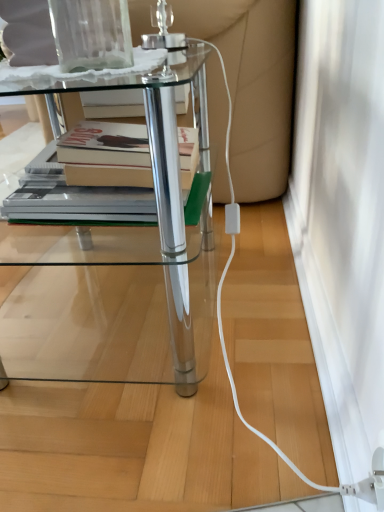
Question: Is clear glass table at center not near transparent glass vase at upper center?

Choices:
 (A) yes
 (B) no

Answer: (B)

Question: Can you confirm if clear glass table at center is taller than transparent glass vase at upper center?

Choices:
 (A) no
 (B) yes

Answer: (B)

Question: Does clear glass table at center turn towards transparent glass vase at upper center?

Choices:
 (A) yes
 (B) no

Answer: (B)

Question: From the image's perspective, is clear glass table at center located beneath transparent glass vase at upper center?

Choices:
 (A) yes
 (B) no

Answer: (A)

Question: Considering the relative positions of clear glass table at center and transparent glass vase at upper center in the image provided, is clear glass table at center to the right of transparent glass vase at upper center from the viewer's perspective?

Choices:
 (A) no
 (B) yes

Answer: (B)

Question: Is clear glass table at center bigger than transparent glass vase at upper center?

Choices:
 (A) no
 (B) yes

Answer: (B)

Question: From the image's perspective, is white matte screen door at lower right on clear glass table at center?

Choices:
 (A) yes
 (B) no

Answer: (B)

Question: Would you say clear glass table at center is part of white matte screen door at lower right's contents?

Choices:
 (A) yes
 (B) no

Answer: (B)

Question: Considering the relative positions of white matte screen door at lower right and clear glass table at center in the image provided, is white matte screen door at lower right to the right of clear glass table at center from the viewer's perspective?

Choices:
 (A) yes
 (B) no

Answer: (A)

Question: Is white matte screen door at lower right oriented towards clear glass table at center?

Choices:
 (A) no
 (B) yes

Answer: (B)

Question: Considering the relative sizes of white matte screen door at lower right and clear glass table at center in the image provided, is white matte screen door at lower right taller than clear glass table at center?

Choices:
 (A) no
 (B) yes

Answer: (A)

Question: Would you consider white matte screen door at lower right to be distant from clear glass table at center?

Choices:
 (A) yes
 (B) no

Answer: (B)

Question: From the image's perspective, is transparent glass vase at upper center located beneath clear glass table at center?

Choices:
 (A) yes
 (B) no

Answer: (B)